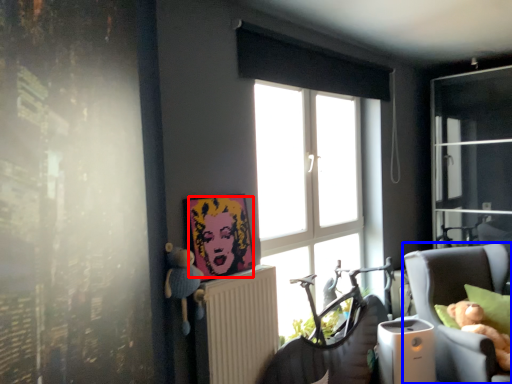
Question: Which of the following is the farthest to the observer, person (highlighted by a red box) or chair (highlighted by a blue box)?

Choices:
 (A) person
 (B) chair

Answer: (B)